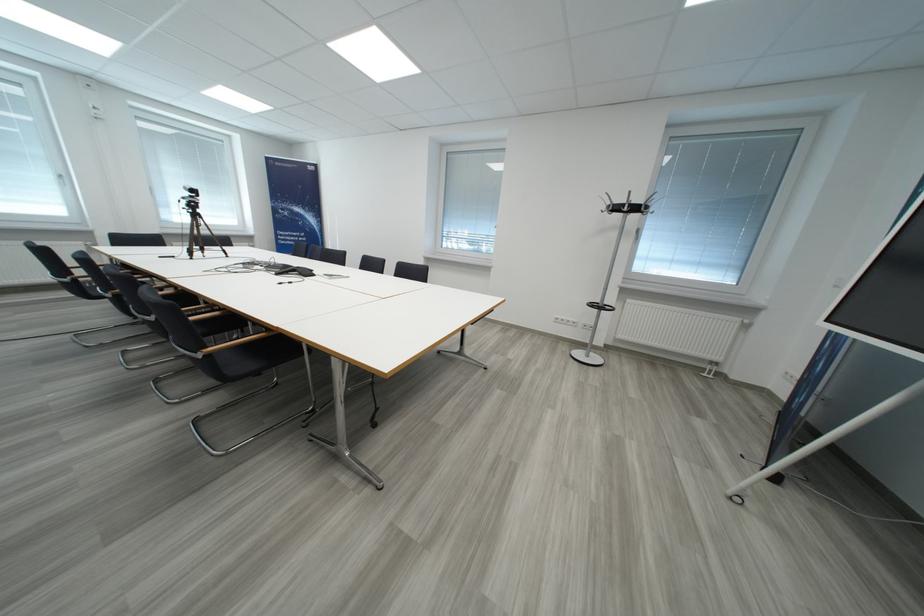
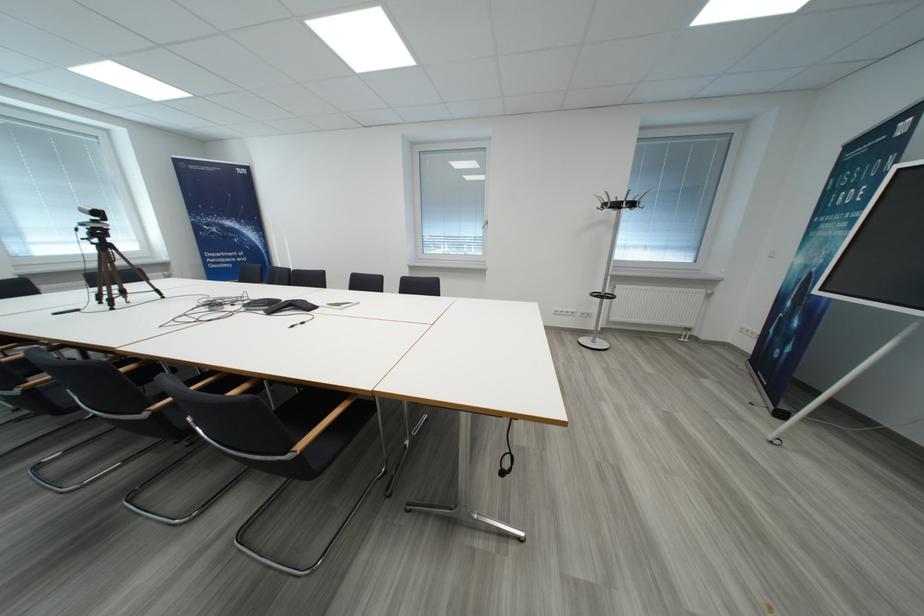
Where in the second image is the point corresponding to [207,359] from the first image?

(296, 460)